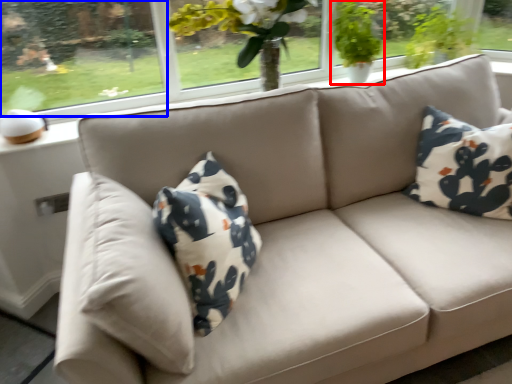
Question: Which point is further to the camera, houseplant (highlighted by a red box) or window screen (highlighted by a blue box)?

Choices:
 (A) houseplant
 (B) window screen

Answer: (A)